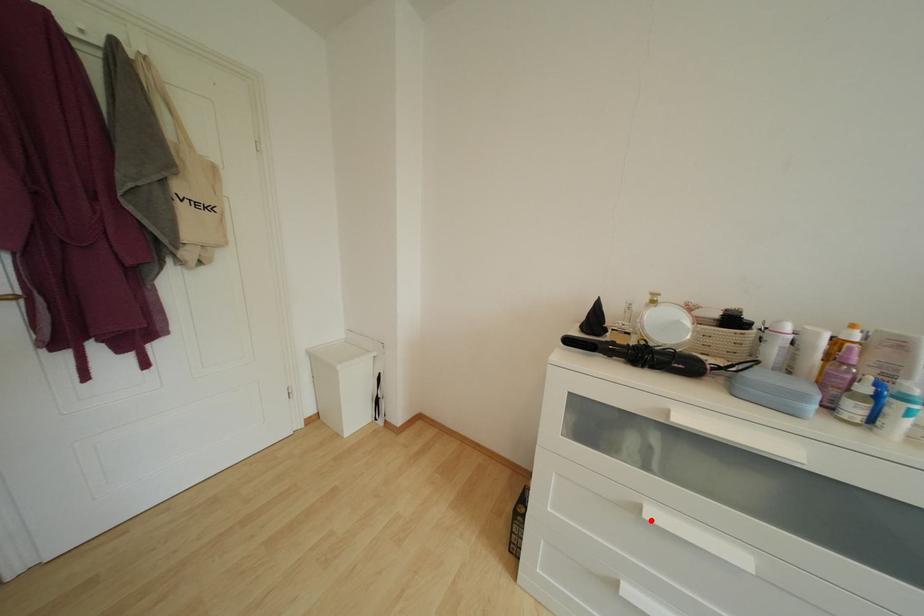
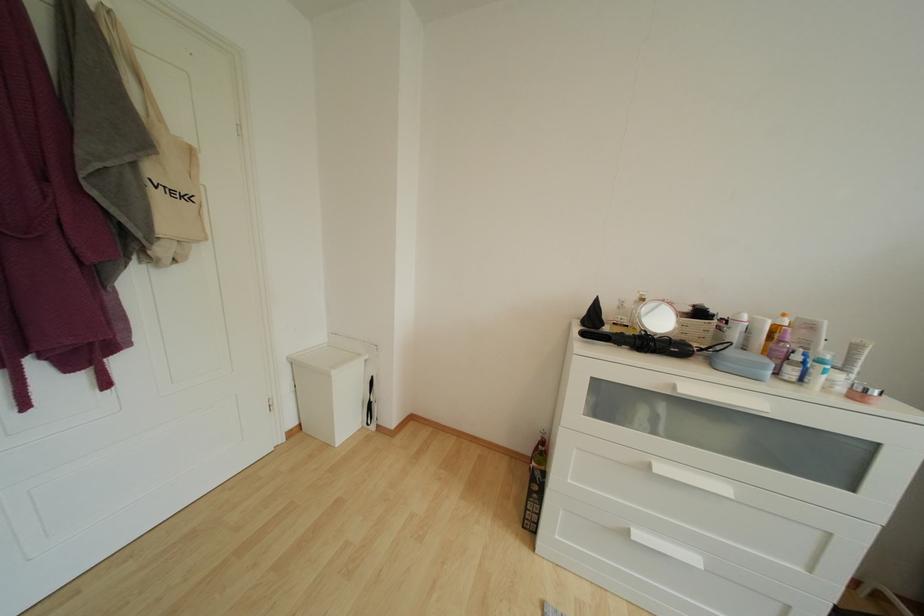
In the second image, find the point that corresponds to the highlighted location in the first image.

(660, 475)